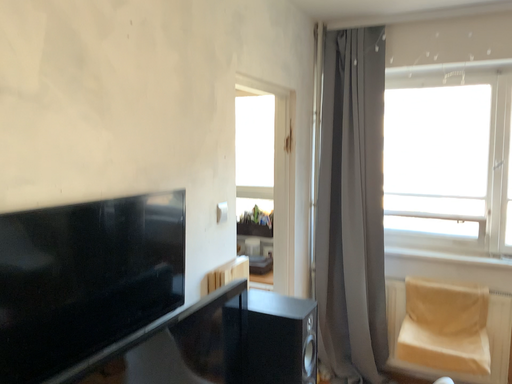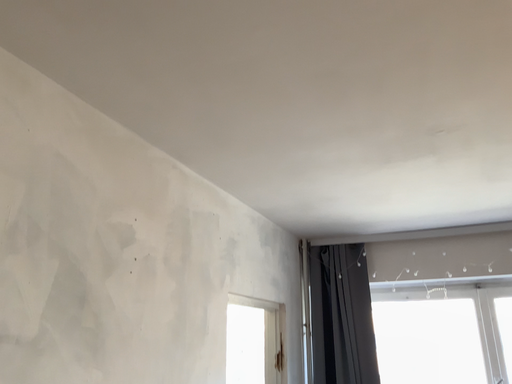
Question: How did the camera likely rotate when shooting the video?

Choices:
 (A) rotated downward
 (B) rotated upward

Answer: (B)